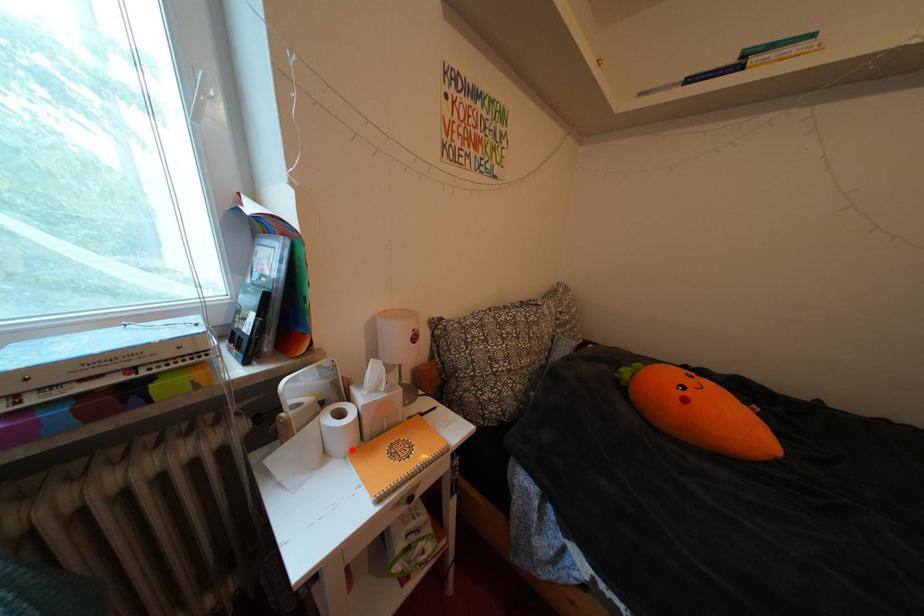
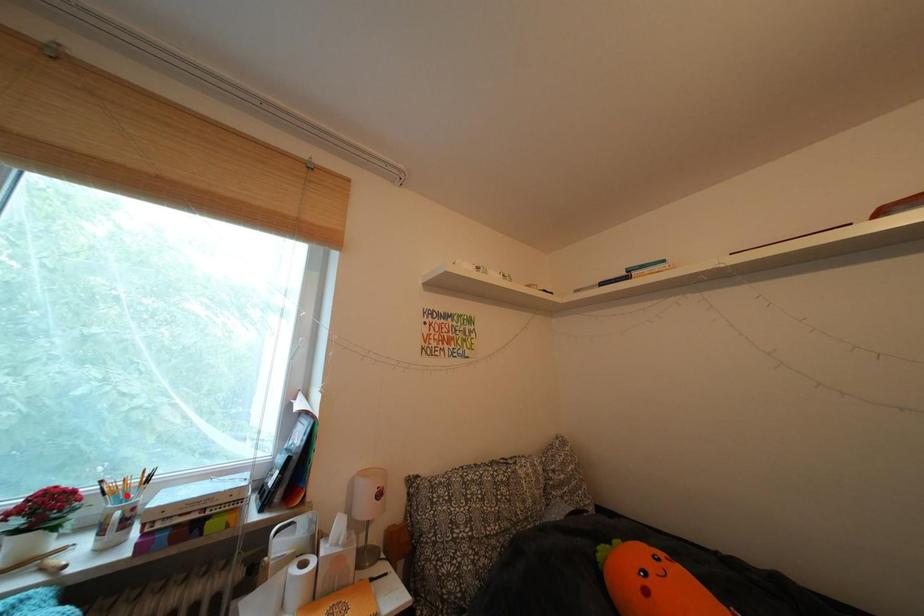
I am providing you with two images of the same scene from different viewpoints. A red point is marked on the first image and another point is marked on the second image. Do the highlighted points in image1 and image2 indicate the same real-world spot?

No